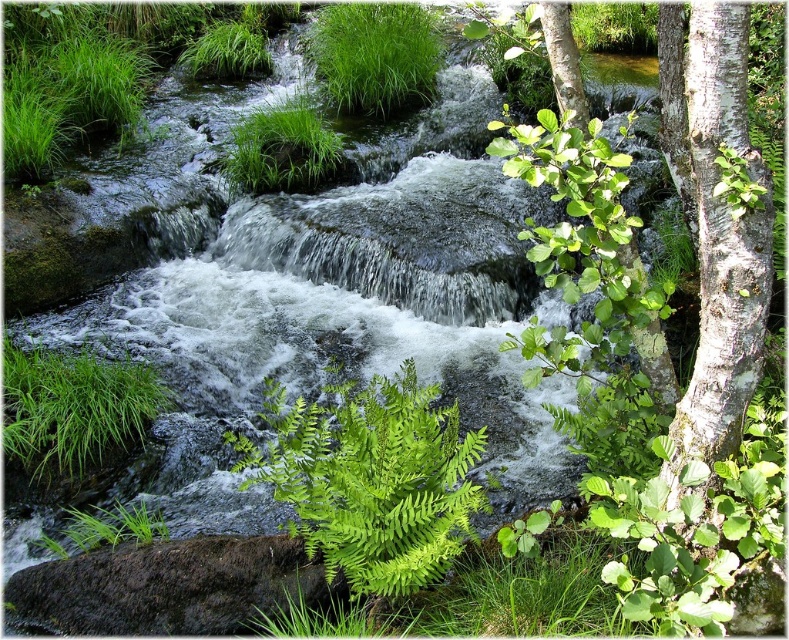
How distant is green leafy grass at lower left from green leafy grass at upper center?

green leafy grass at lower left is 15.13 feet away from green leafy grass at upper center.

Which of these two, green leafy grass at lower left or green leafy grass at upper center, stands taller?

Standing taller between the two is green leafy grass at upper center.

Who is more distant from viewer, (136,381) or (397,49)?

The point (397,49) is more distant.

Where is `green leafy grass at lower left`? This screenshot has width=789, height=640. green leafy grass at lower left is located at coordinates (73, 410).

Who is lower down, green leafy fern at center or white smooth bark tree at right?

green leafy fern at center is lower down.

Is green leafy fern at center to the right of white smooth bark tree at right from the viewer's perspective?

Incorrect, green leafy fern at center is not on the right side of white smooth bark tree at right.

Does point (328, 492) lie in front of point (712, 116)?

No, (328, 492) is behind (712, 116).

The height and width of the screenshot is (640, 789). I want to click on green leafy fern at center, so click(371, 480).

Is point (705, 308) less distant than point (282, 141)?

Yes, point (705, 308) is closer to viewer.

Where is `white smooth bark tree at right`? This screenshot has width=789, height=640. white smooth bark tree at right is located at coordinates (716, 224).